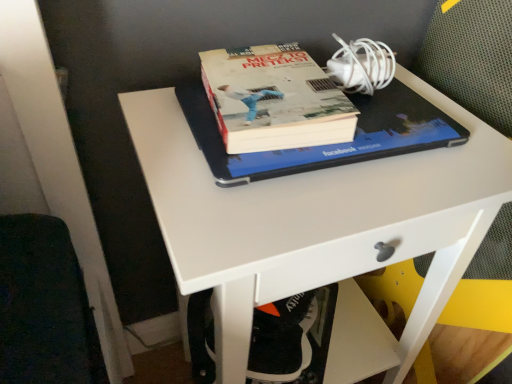
Where is `free space above hardcover book at center (from a real-world perspective)`? Image resolution: width=512 pixels, height=384 pixels. free space above hardcover book at center (from a real-world perspective) is located at coordinates (273, 76).